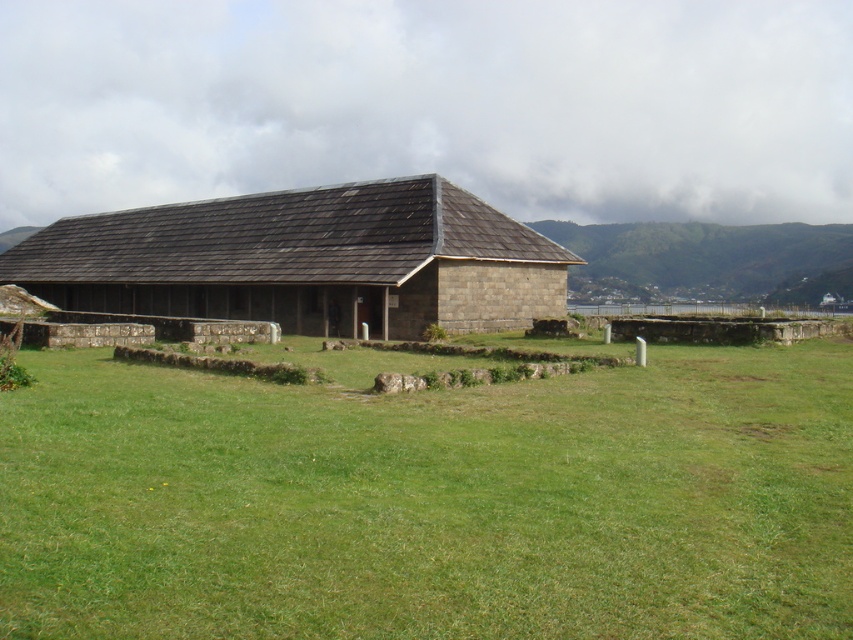
You are planning to set up a temporary tent in the open area near the stone shingled hut at center and the green grassy hillside at upper right. Considering their sizes, which location would provide more space for the tent?

The green grassy hillside at upper right would provide more space for the tent since it occupies more area than the stone shingled hut at center.

You are standing at the entrance of the historical structure and want to place a 5 meter long wooden bench between the green grass at center and the structure. Is there enough space to place it without overlapping either the structure or the grass?

The distance between the green grass at center and the structure is 4.56 meters. Since the bench is 5 meters long, it would not fit as it is longer than the available space. Therefore, the bench cannot be placed without overlapping either the structure or the grass.